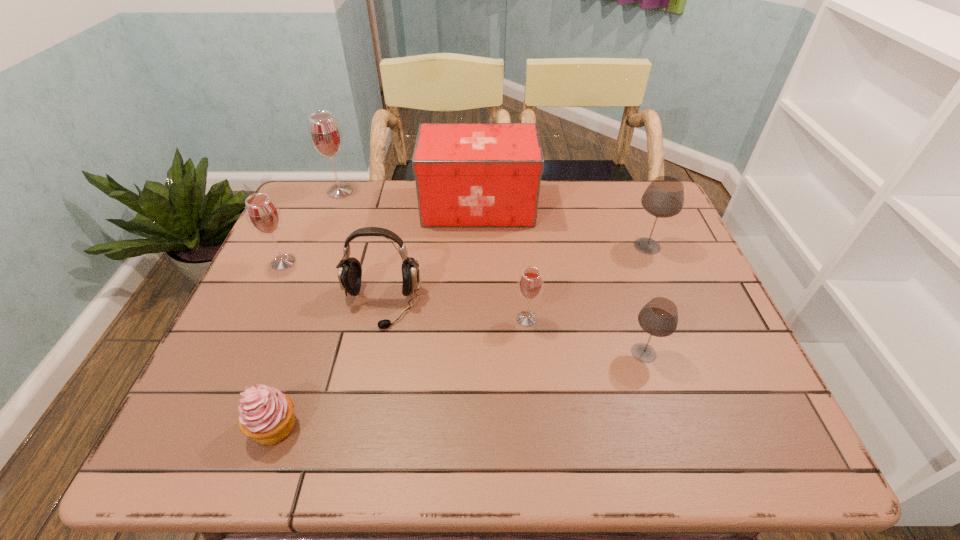
Image resolution: width=960 pixels, height=540 pixels. Find the location of `vacant space at the left edge of the desktop`. vacant space at the left edge of the desktop is located at coordinates pos(262,278).

Image resolution: width=960 pixels, height=540 pixels. Identify the location of free space that is in between the headset and the tallest wineglass. (361, 248).

Image resolution: width=960 pixels, height=540 pixels. What are the coordinates of `free space between the headset and the seventh object from left to right` in the screenshot? It's located at (513, 329).

I want to click on free space that is in between the headset and the bigger gray wineglass, so click(x=515, y=275).

I want to click on vacant area that lies between the headset and the second farthest red wineglass, so click(332, 283).

Find the location of `free space between the second nearest wineglass and the nearest object`. free space between the second nearest wineglass and the nearest object is located at coordinates (400, 373).

This screenshot has height=540, width=960. In order to click on vacant space in between the headset and the left gray wineglass in this screenshot , I will do `click(513, 329)`.

The width and height of the screenshot is (960, 540). In order to click on free spot between the nearest red wineglass and the second wineglass from right to left in this screenshot , I will do `click(586, 336)`.

The width and height of the screenshot is (960, 540). What are the coordinates of `vacant region between the cupcake and the nearest red wineglass` in the screenshot? It's located at (400, 373).

Identify which object is the fifth nearest to the biggest red wineglass. Please provide its 2D coordinates. Your answer should be formatted as a tuple, i.e. [(x, y)], where the tuple contains the x and y coordinates of a point satisfying the conditions above.

[(266, 415)]